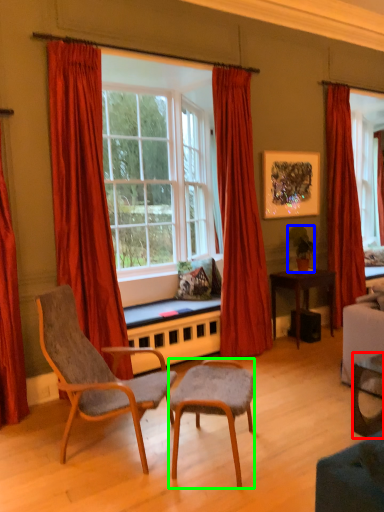
Question: Which object is the closest to the desk (highlighted by a red box)? Choose among these: houseplant (highlighted by a blue box) or chair (highlighted by a green box).

Choices:
 (A) houseplant
 (B) chair

Answer: (B)